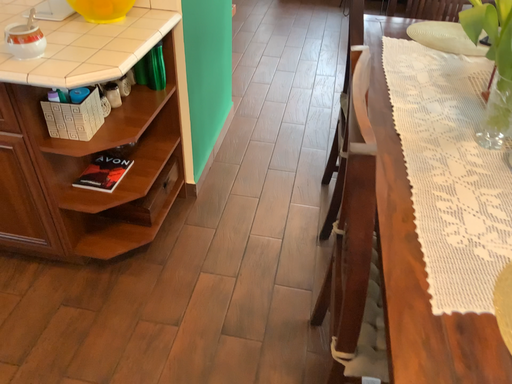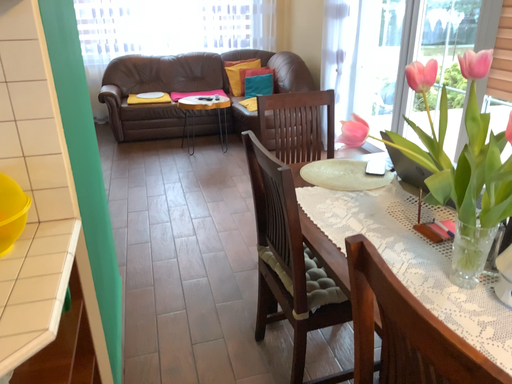
Question: Which way did the camera rotate in the video?

Choices:
 (A) rotated upward
 (B) rotated downward

Answer: (A)